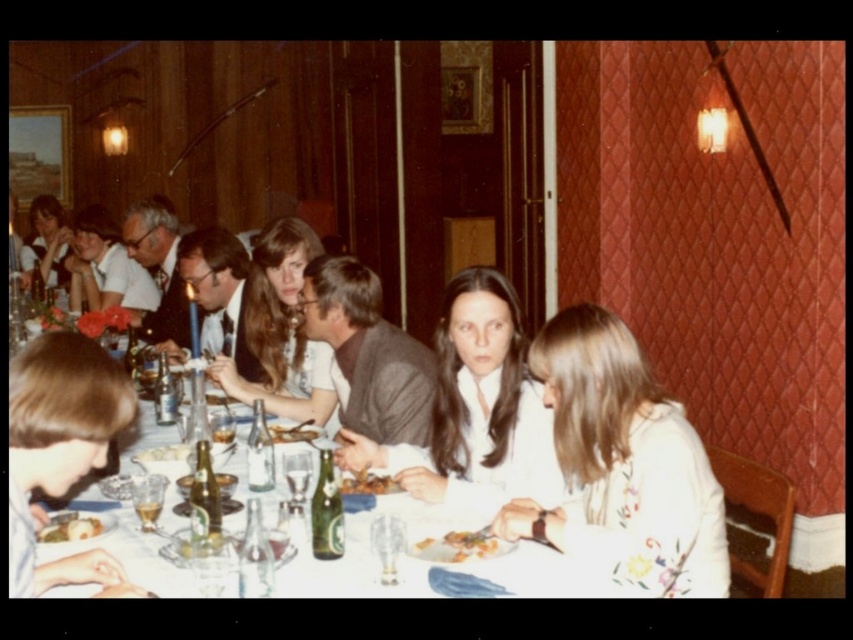
Question: Can you confirm if white floral blouse at center is bigger than matte white shirt at center?

Choices:
 (A) no
 (B) yes

Answer: (A)

Question: Which object is the farthest from the golden brown crispy chicken at center?

Choices:
 (A) light blue shirt at lower left
 (B) matte black hair at upper left

Answer: (B)

Question: Is light blue shirt at lower left bigger than golden crispy bread at center?

Choices:
 (A) yes
 (B) no

Answer: (A)

Question: Is white floral blouse at center to the left of dark gray sweater at center from the viewer's perspective?

Choices:
 (A) yes
 (B) no

Answer: (B)

Question: Which of the following is the farthest from the observer?

Choices:
 (A) white floral blouse at center
 (B) matte black hair at upper left

Answer: (B)

Question: Which point is farther to the camera?

Choices:
 (A) light blue shirt at lower left
 (B) white floral blouse at center
 (C) matte black hair at upper left
 (D) white matte shirt at center

Answer: (C)